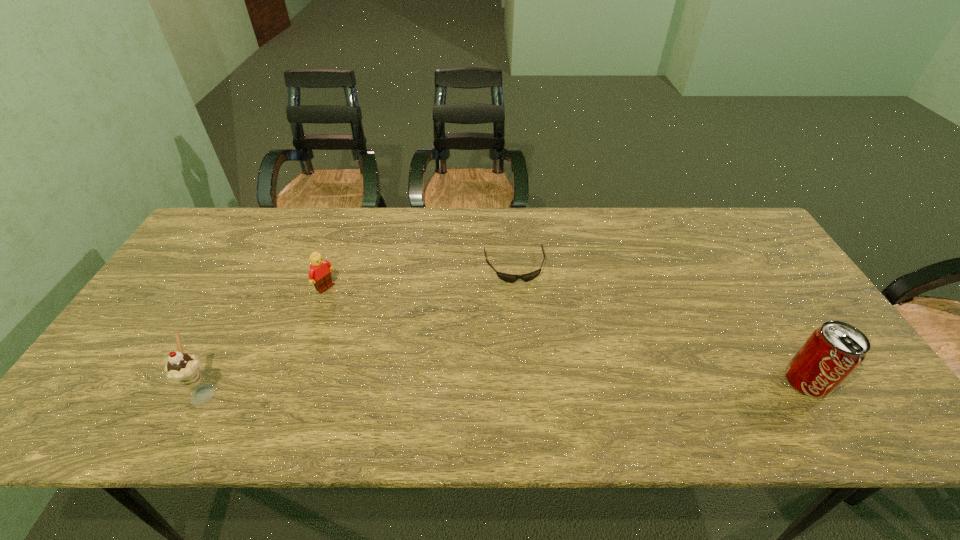
Where is `vacant space on the desktop that is between the leftmost object and the rightmost object and is positioned on the front-facing side of the third object from left to right`? This screenshot has height=540, width=960. vacant space on the desktop that is between the leftmost object and the rightmost object and is positioned on the front-facing side of the third object from left to right is located at coordinates (540, 386).

What are the coordinates of `free space on the desktop that is between the leftmost object and the rightmost object and is positioned on the face of the third object from right to left` in the screenshot? It's located at (472, 387).